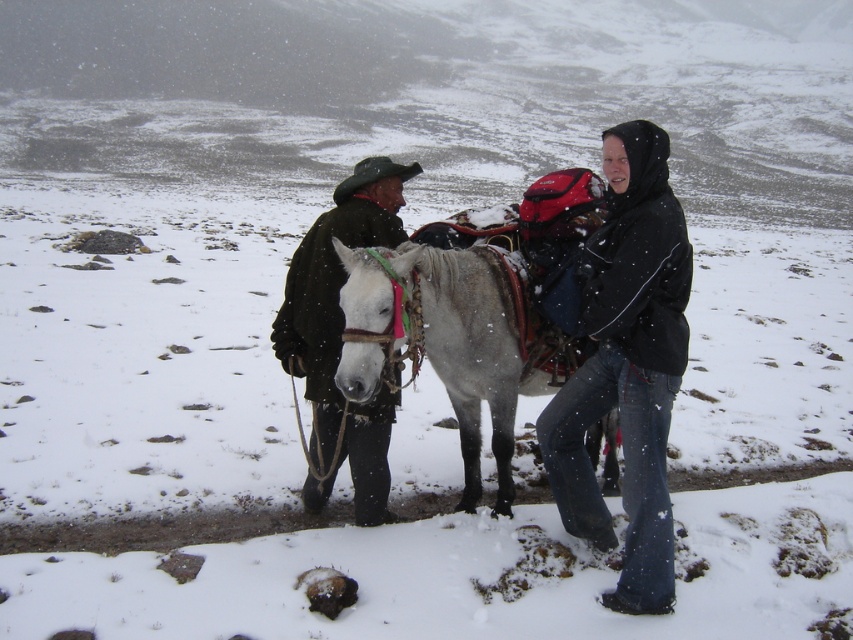
Question: Which point is closer to the camera?

Choices:
 (A) matte black jacket at center
 (B) dark brown leather jacket at center
 (C) white leather mule at center
 (D) black matte jacket at center

Answer: (C)

Question: Which object appears closest to the camera in this image?

Choices:
 (A) white leather mule at center
 (B) black matte jacket at center
 (C) matte black jacket at center
 (D) dark brown leather jacket at center

Answer: (A)

Question: Is black matte jacket at center positioned in front of white leather mule at center?

Choices:
 (A) no
 (B) yes

Answer: (A)

Question: Does matte black jacket at center have a larger size compared to black matte jacket at center?

Choices:
 (A) yes
 (B) no

Answer: (B)

Question: Does black matte jacket at center appear on the left side of white leather mule at center?

Choices:
 (A) yes
 (B) no

Answer: (B)

Question: Estimate the real-world distances between objects in this image. Which object is closer to the matte black jacket at center?

Choices:
 (A) white leather mule at center
 (B) black matte jacket at center
 (C) dark brown leather jacket at center

Answer: (B)